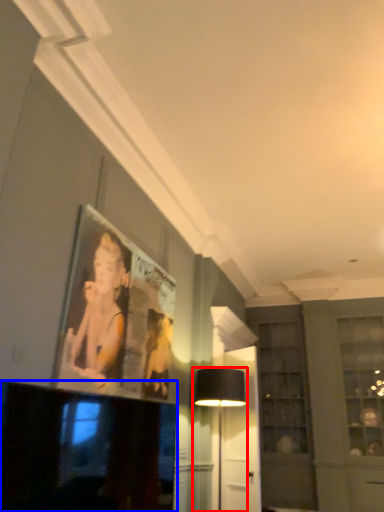
Question: Which object is closer to the camera taking this photo, table lamp (highlighted by a red box) or television (highlighted by a blue box)?

Choices:
 (A) table lamp
 (B) television

Answer: (B)